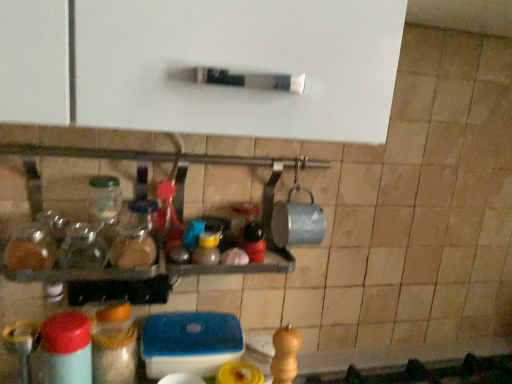
Describe the element at coordinates (114, 346) in the screenshot. I see `translucent plastic container at lower center, the second bottle from the bottom` at that location.

Image resolution: width=512 pixels, height=384 pixels. Describe the element at coordinates (63, 350) in the screenshot. I see `matte plastic bottle at lower left, the first bottle when ordered from bottom to top` at that location.

Image resolution: width=512 pixels, height=384 pixels. Find the location of `translucent plastic container at lower center, acting as the 2th bottle starting from the top`. translucent plastic container at lower center, acting as the 2th bottle starting from the top is located at coordinates (114, 346).

From a real-world perspective, is translucent plastic container at lower center, acting as the 2th bottle starting from the top, under matte plastic bottle at lower left, placed as the third bottle when sorted from top to bottom?

Yes.

Which is behind, point (97, 329) or point (71, 349)?

The point (97, 329) is farther.

In terms of height, does translucent plastic container at lower center, the second bottle from the bottom, look taller or shorter compared to matte plastic bottle at lower left, the first bottle when ordered from bottom to top?

Clearly, translucent plastic container at lower center, the second bottle from the bottom, is shorter compared to matte plastic bottle at lower left, the first bottle when ordered from bottom to top.

In the scene shown: Would you say translucent plastic container at lower center, the second bottle from the bottom, is a long distance from matte plastic bottle at lower left, the first bottle when ordered from bottom to top?

They are positioned close to each other.

From the image's perspective, which is below, matte plastic bottle at lower left, placed as the third bottle when sorted from top to bottom, or translucent glass jar at center, marked as the third bottle in a bottom-to-top arrangement?

matte plastic bottle at lower left, placed as the third bottle when sorted from top to bottom.

Is matte plastic bottle at lower left, placed as the third bottle when sorted from top to bottom, aimed at translucent glass jar at center, marked as the third bottle in a bottom-to-top arrangement?

No, matte plastic bottle at lower left, placed as the third bottle when sorted from top to bottom, is not facing towards translucent glass jar at center, marked as the third bottle in a bottom-to-top arrangement.

Is matte plastic bottle at lower left, placed as the third bottle when sorted from top to bottom, thinner than translucent glass jar at center, marked as the third bottle in a bottom-to-top arrangement?

Indeed, matte plastic bottle at lower left, placed as the third bottle when sorted from top to bottom, has a lesser width compared to translucent glass jar at center, marked as the third bottle in a bottom-to-top arrangement.

Is matte plastic bottle at lower left, the first bottle when ordered from bottom to top, beside translucent glass jar at center, the 1th bottle viewed from the top?

No.

From a real-world perspective, which is physically above, translucent glass jar at center, marked as the third bottle in a bottom-to-top arrangement, or matte plastic bottle at lower left, placed as the third bottle when sorted from top to bottom?

translucent glass jar at center, marked as the third bottle in a bottom-to-top arrangement.

Is translucent glass jar at center, marked as the third bottle in a bottom-to-top arrangement, looking in the opposite direction of matte plastic bottle at lower left, the first bottle when ordered from bottom to top?

translucent glass jar at center, marked as the third bottle in a bottom-to-top arrangement, is not turned away from matte plastic bottle at lower left, the first bottle when ordered from bottom to top.

Which object is more forward, translucent glass jar at center, the 1th bottle viewed from the top, or matte plastic bottle at lower left, the first bottle when ordered from bottom to top?

matte plastic bottle at lower left, the first bottle when ordered from bottom to top, is closer to the camera.

From the image's perspective, which is above, translucent glass jar at center, marked as the third bottle in a bottom-to-top arrangement, or matte plastic bottle at lower left, placed as the third bottle when sorted from top to bottom?

translucent glass jar at center, marked as the third bottle in a bottom-to-top arrangement, appears higher in the image.

From the image's perspective, is matte plastic bottle at lower left, placed as the third bottle when sorted from top to bottom, on top of translucent plastic container at lower center, acting as the 2th bottle starting from the top?

Actually, matte plastic bottle at lower left, placed as the third bottle when sorted from top to bottom, appears below translucent plastic container at lower center, acting as the 2th bottle starting from the top, in the image.

Do you think matte plastic bottle at lower left, placed as the third bottle when sorted from top to bottom, is within translucent plastic container at lower center, acting as the 2th bottle starting from the top, or outside of it?

matte plastic bottle at lower left, placed as the third bottle when sorted from top to bottom, is outside translucent plastic container at lower center, acting as the 2th bottle starting from the top.

Between matte plastic bottle at lower left, the first bottle when ordered from bottom to top, and translucent plastic container at lower center, acting as the 2th bottle starting from the top, which one has smaller width?

With smaller width is matte plastic bottle at lower left, the first bottle when ordered from bottom to top.

How distant is matte plastic bottle at lower left, placed as the third bottle when sorted from top to bottom, from translucent plastic container at lower center, acting as the 2th bottle starting from the top?

They are 2.80 inches apart.

Looking at this image, from a real-world perspective, is translucent plastic container at lower center, the second bottle from the bottom, on translucent glass jar at center, the 1th bottle viewed from the top?

No.

Which object is positioned more to the left, translucent plastic container at lower center, acting as the 2th bottle starting from the top, or translucent glass jar at center, marked as the third bottle in a bottom-to-top arrangement?

translucent plastic container at lower center, acting as the 2th bottle starting from the top.

Does point (98, 352) come behind point (140, 266)?

Yes, point (98, 352) is farther from viewer.

Considering the sizes of objects translucent plastic container at lower center, the second bottle from the bottom, and translucent glass jar at center, marked as the third bottle in a bottom-to-top arrangement, in the image provided, who is taller, translucent plastic container at lower center, the second bottle from the bottom, or translucent glass jar at center, marked as the third bottle in a bottom-to-top arrangement,?

translucent plastic container at lower center, the second bottle from the bottom.

Considering the sizes of objects translucent glass jar at center, the 1th bottle viewed from the top, and translucent plastic container at lower center, the second bottle from the bottom, in the image provided, who is thinner, translucent glass jar at center, the 1th bottle viewed from the top, or translucent plastic container at lower center, the second bottle from the bottom,?

With smaller width is translucent plastic container at lower center, the second bottle from the bottom.

Measure the distance from translucent glass jar at center, the 1th bottle viewed from the top, to translucent plastic container at lower center, acting as the 2th bottle starting from the top.

6.17 inches.

From the picture: Considering the relative positions of translucent glass jar at center, marked as the third bottle in a bottom-to-top arrangement, and translucent plastic container at lower center, the second bottle from the bottom, in the image provided, is translucent glass jar at center, marked as the third bottle in a bottom-to-top arrangement, to the left or to the right of translucent plastic container at lower center, the second bottle from the bottom,?

Based on their positions, translucent glass jar at center, marked as the third bottle in a bottom-to-top arrangement, is located to the right of translucent plastic container at lower center, the second bottle from the bottom.

Where is `the 1st bottle counting from the left of the translucent glass jar at center, the 1th bottle viewed from the top`? the 1st bottle counting from the left of the translucent glass jar at center, the 1th bottle viewed from the top is located at coordinates (114, 346).

Which bottle is the 1st one when counting from the right side of the matte plastic bottle at lower left, placed as the third bottle when sorted from top to bottom? Please provide its 2D coordinates.

[(114, 346)]

This screenshot has width=512, height=384. What are the coordinates of `bottle in front of the translucent glass jar at center, the 1th bottle viewed from the top` in the screenshot? It's located at (63, 350).

From the image, which object appears to be farther from translucent plastic container at lower center, acting as the 2th bottle starting from the top, translucent glass jar at center, the 1th bottle viewed from the top, or matte plastic bottle at lower left, placed as the third bottle when sorted from top to bottom?

Based on the image, translucent glass jar at center, the 1th bottle viewed from the top, appears to be further to translucent plastic container at lower center, acting as the 2th bottle starting from the top.

Considering their positions, is translucent plastic container at lower center, acting as the 2th bottle starting from the top, positioned closer to translucent glass jar at center, marked as the third bottle in a bottom-to-top arrangement, than matte plastic bottle at lower left, placed as the third bottle when sorted from top to bottom?

translucent plastic container at lower center, acting as the 2th bottle starting from the top.

Estimate the real-world distances between objects in this image. Which object is closer to translucent glass jar at center, marked as the third bottle in a bottom-to-top arrangement, matte plastic bottle at lower left, placed as the third bottle when sorted from top to bottom, or translucent plastic container at lower center, acting as the 2th bottle starting from the top?

translucent plastic container at lower center, acting as the 2th bottle starting from the top.

Based on their spatial positions, is translucent glass jar at center, marked as the third bottle in a bottom-to-top arrangement, or translucent plastic container at lower center, the second bottle from the bottom, further from matte plastic bottle at lower left, placed as the third bottle when sorted from top to bottom?

translucent glass jar at center, marked as the third bottle in a bottom-to-top arrangement, is positioned further to the anchor matte plastic bottle at lower left, placed as the third bottle when sorted from top to bottom.

From the picture: Considering their positions, is translucent plastic container at lower center, acting as the 2th bottle starting from the top, positioned closer to matte plastic bottle at lower left, placed as the third bottle when sorted from top to bottom, than translucent glass jar at center, the 1th bottle viewed from the top?

Based on the image, translucent plastic container at lower center, acting as the 2th bottle starting from the top, appears to be nearer to matte plastic bottle at lower left, placed as the third bottle when sorted from top to bottom.

From the image, which object appears to be nearer to translucent plastic container at lower center, acting as the 2th bottle starting from the top, matte plastic bottle at lower left, the first bottle when ordered from bottom to top, or translucent glass jar at center, marked as the third bottle in a bottom-to-top arrangement?

Among the two, matte plastic bottle at lower left, the first bottle when ordered from bottom to top, is located nearer to translucent plastic container at lower center, acting as the 2th bottle starting from the top.

In order to click on bottle between translucent glass jar at center, the 1th bottle viewed from the top, and matte plastic bottle at lower left, placed as the third bottle when sorted from top to bottom, from top to bottom in this screenshot , I will do `click(114, 346)`.